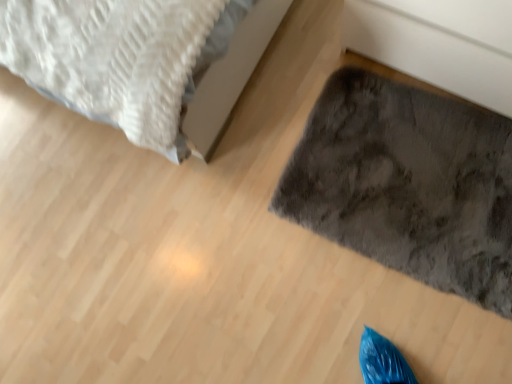
Identify the location of vacant location below gray fluffy rug at lower right (from a real-world perspective). [396, 203].